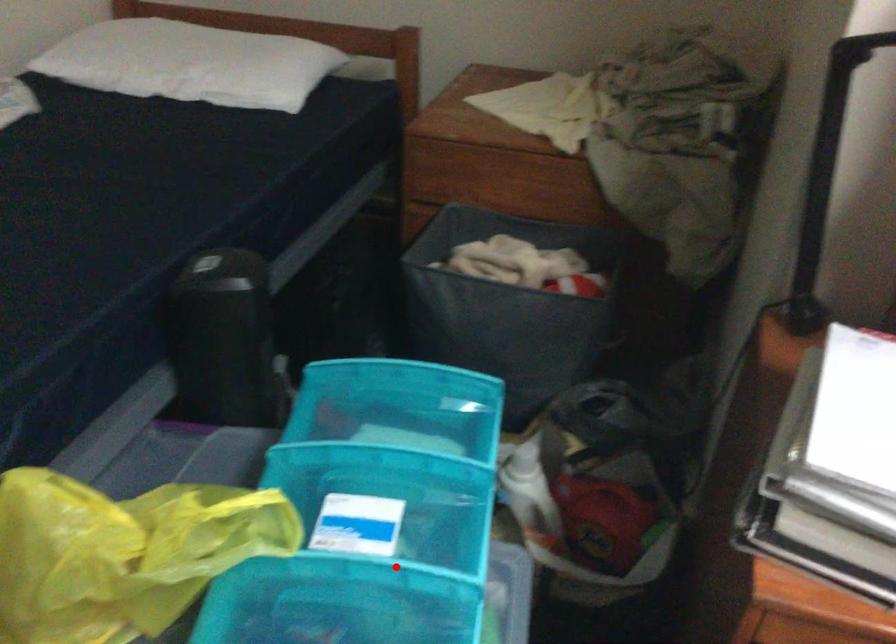
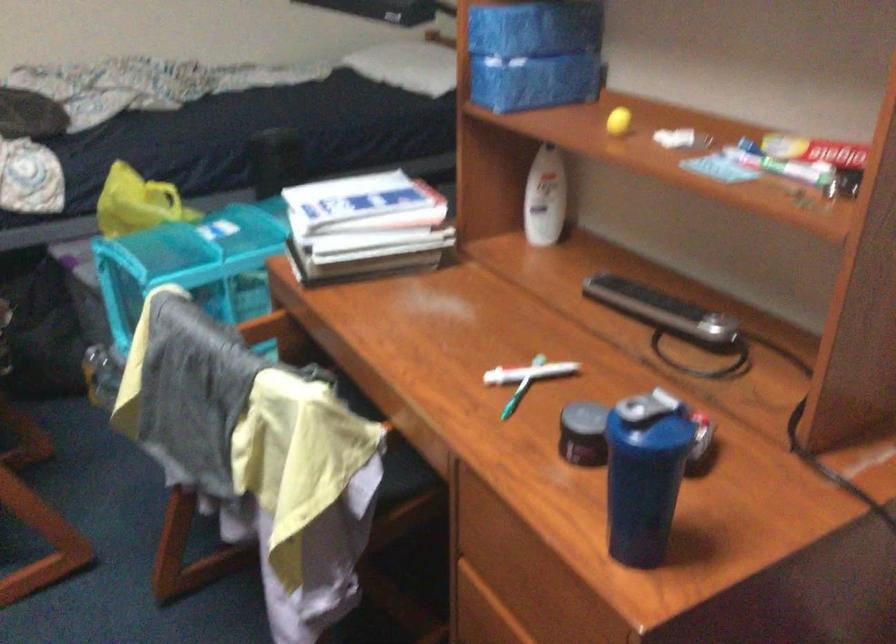
Locate, in the second image, the point that corresponds to the highlighted location in the first image.

(205, 239)